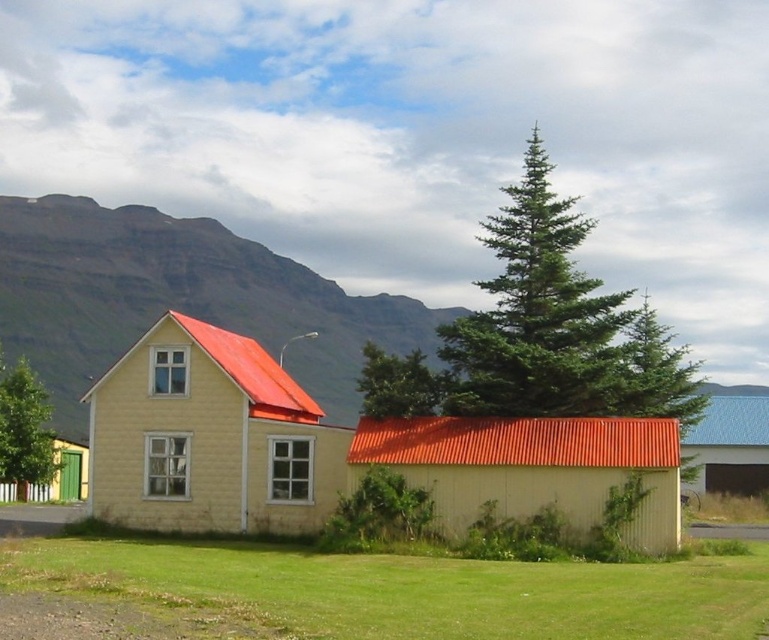
You are standing in front of the house and want to take a photo of the metallic corrugated hut at center. To include the rugged rock mountain at left in the background, should you aim your camera to the left or right of the hut?

You should aim your camera to the left of the metallic corrugated hut at center because the rugged rock mountain at left is located to the left of it.